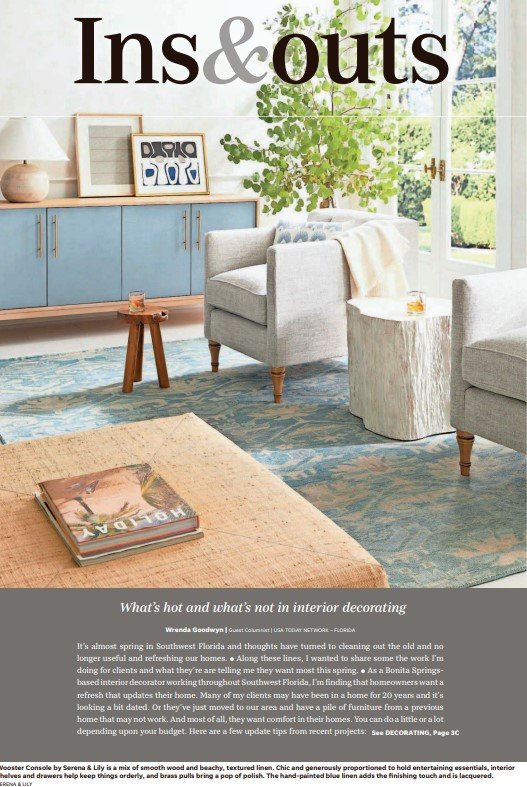
You are a GUI agent. You are given a task and a screenshot of the screen. Output one action in this format:
    pyautogui.click(x=<x>, y=<y>)
    Task: Click on the blue door panels
    This screenshot has width=527, height=787.
    Given the screenshot: What is the action you would take?
    pyautogui.click(x=223, y=212), pyautogui.click(x=148, y=227), pyautogui.click(x=92, y=212), pyautogui.click(x=18, y=260)